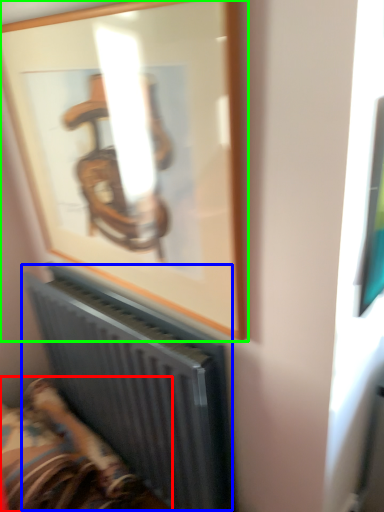
Question: Which object is positioned farthest from furniture (highlighted by a red box)? Select from radiator (highlighted by a blue box) and picture frame (highlighted by a green box).

Choices:
 (A) radiator
 (B) picture frame

Answer: (B)